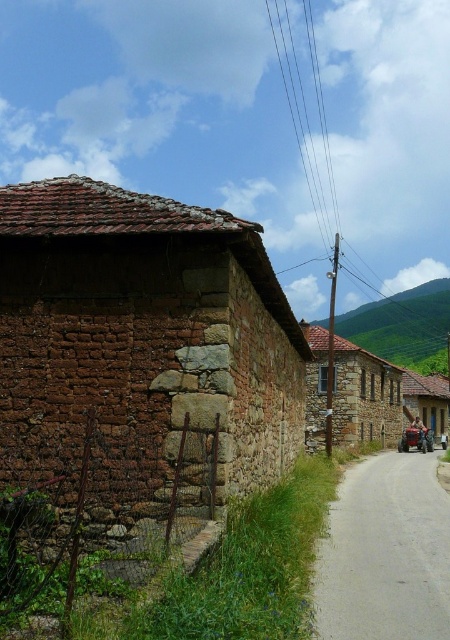
Who is lower down, brown stone wall at left or brown stone hut at center?

brown stone hut at center is below.

Is point (21, 301) closer to viewer compared to point (320, 337)?

Yes, point (21, 301) is in front of point (320, 337).

Which is in front, point (67, 371) or point (338, 396)?

Point (67, 371) is in front.

This screenshot has height=640, width=450. Identify the location of brown stone wall at left. (144, 333).

How far apart are brown stone hut at center and rustic wooden cart at right?

They are 10.97 meters apart.

Is brown stone hut at center closer to the viewer compared to rustic wooden cart at right?

Yes, brown stone hut at center is closer to the viewer.

Identify the location of brown stone hut at center. (364, 396).

Between point (287, 346) and point (406, 380), which one is positioned behind?

Positioned behind is point (406, 380).

Is brown stone wall at left below rustic wooden cart at right?

No.

Who is more distant from viewer, (8, 392) or (423, 420)?

Point (423, 420)

This screenshot has height=640, width=450. I want to click on brown stone wall at left, so click(x=144, y=333).